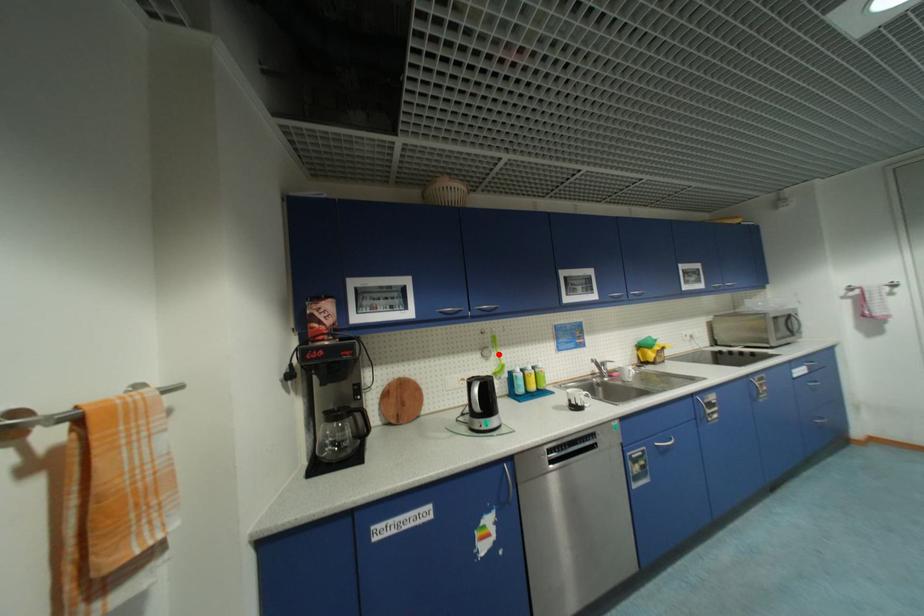
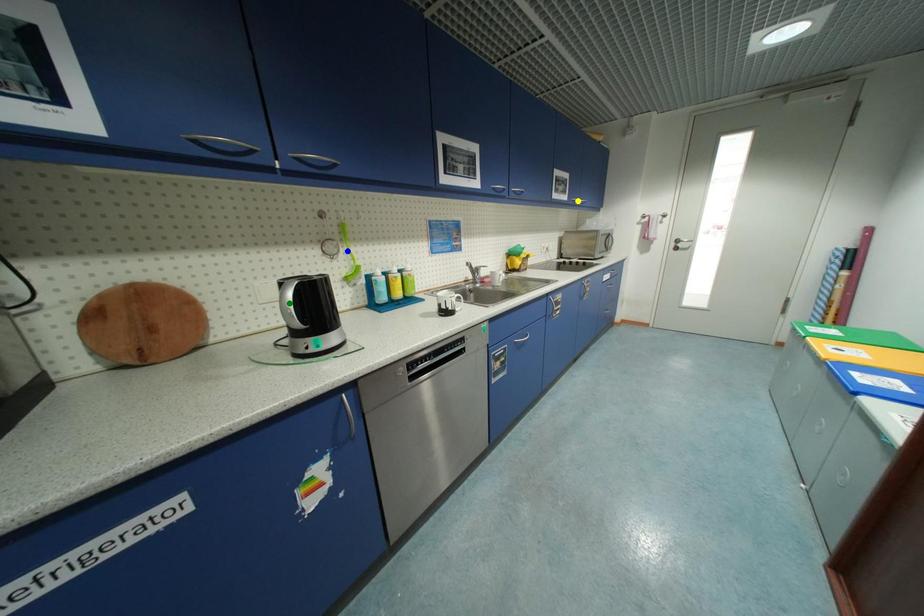
Question: I am providing you with two images of the same scene from different viewpoints. A red point is marked on the first image. You are given multiple points on the second image. Which mark in image 2 goes with the point in image 1?

Choices:
 (A) green point
 (B) yellow point
 (C) blue point

Answer: (C)